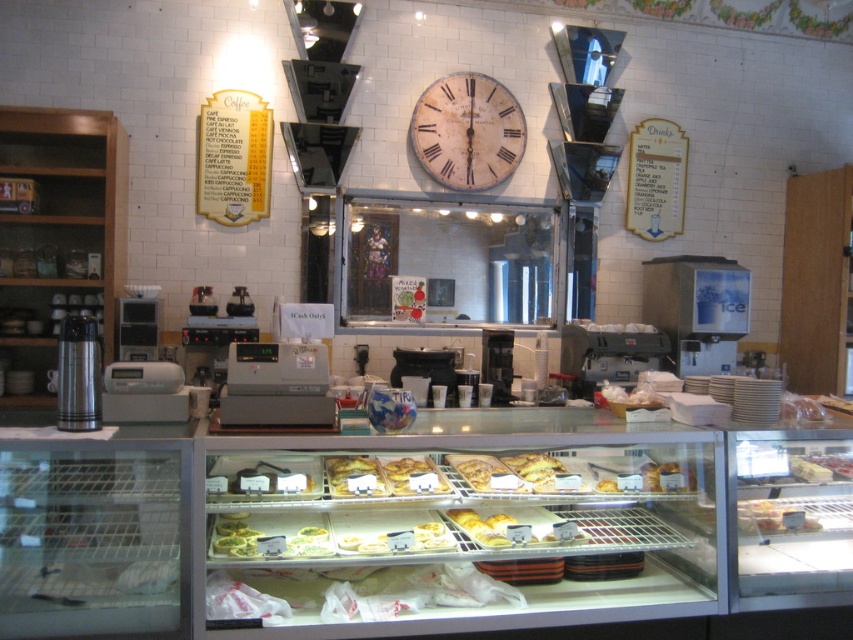
Question: Does white wooden clock at center come behind golden brown flaky pastry at center?

Choices:
 (A) yes
 (B) no

Answer: (A)

Question: Based on their relative distances, which object is nearer to the golden brown pastry at center?

Choices:
 (A) golden brown flaky pastry at center
 (B) white wooden clock at center

Answer: (A)

Question: Where is golden brown flaky pastry at center located in relation to golden brown pastry at center in the image?

Choices:
 (A) left
 (B) right

Answer: (A)

Question: Which point is farther to the camera?

Choices:
 (A) (376, 465)
 (B) (453, 92)
 (C) (393, 493)

Answer: (B)

Question: Which point is closer to the camera taking this photo?

Choices:
 (A) (430, 468)
 (B) (341, 467)

Answer: (B)

Question: Observing the image, what is the correct spatial positioning of white wooden clock at center in reference to golden brown flaky pastry at center?

Choices:
 (A) below
 (B) above

Answer: (B)